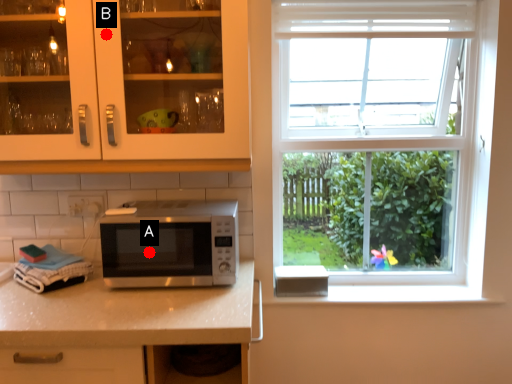
Question: Two points are circled on the image, labeled by A and B beside each circle. Which point appears closest to the camera in this image?

Choices:
 (A) A is closer
 (B) B is closer

Answer: (B)